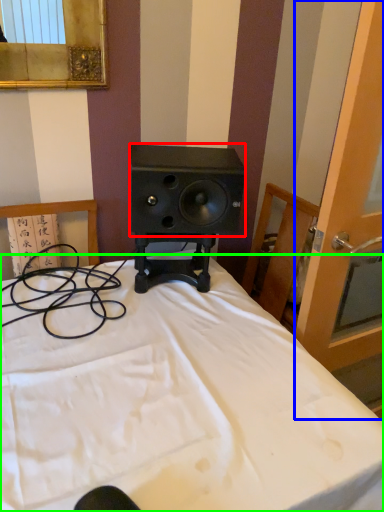
Question: Which is farther away from speaker (highlighted by a red box)? screen door (highlighted by a blue box) or bed (highlighted by a green box)?

Choices:
 (A) screen door
 (B) bed

Answer: (B)